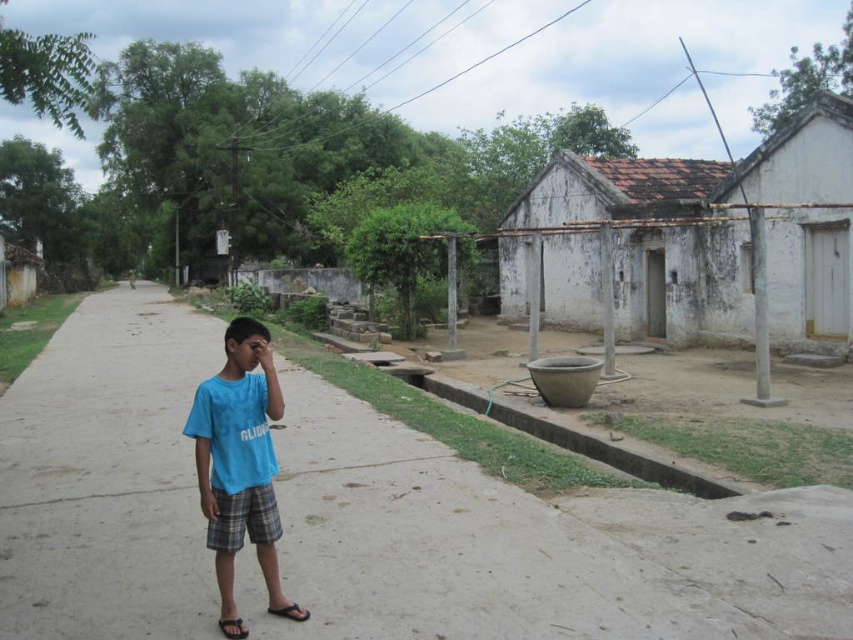
You are a delivery drone trying to land on the gray concrete pavement at center. The landing coordinates provided are at point 0.855, 0.619. Are you currently at the correct landing coordinates?

The gray concrete pavement at center is located at point (527,547), so yes, you are at the correct landing coordinates.